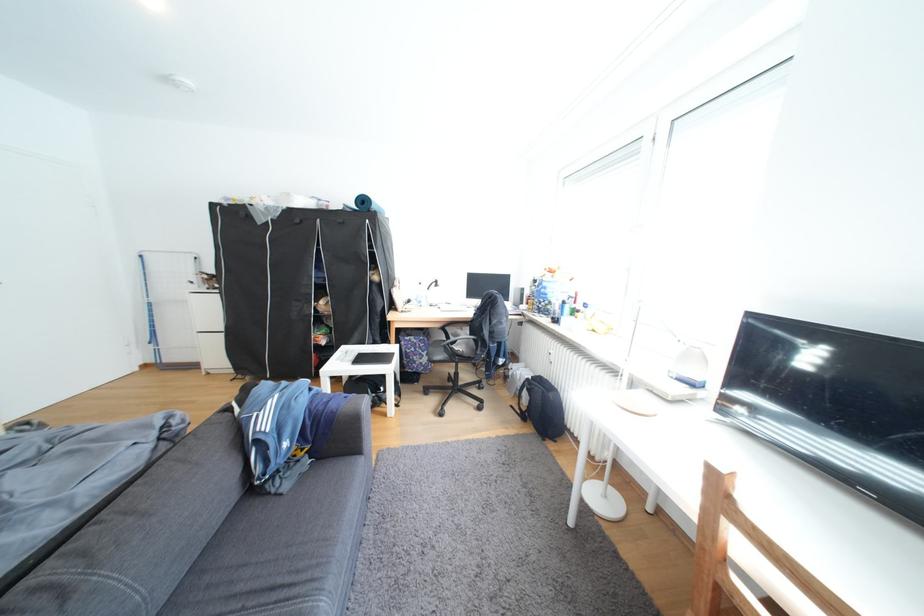
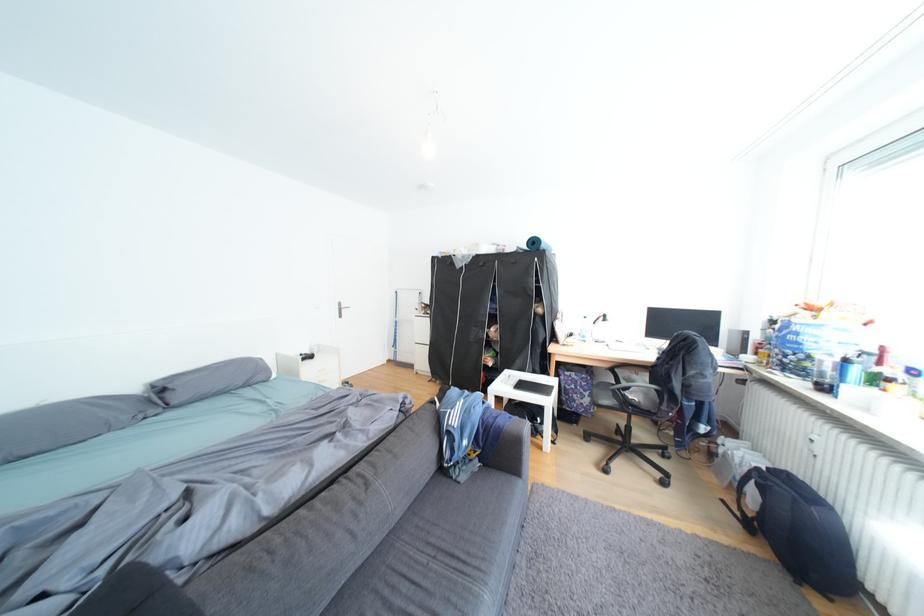
Locate, in the second image, the point that corresponds to the point at 298,446 in the first image.

(478, 444)